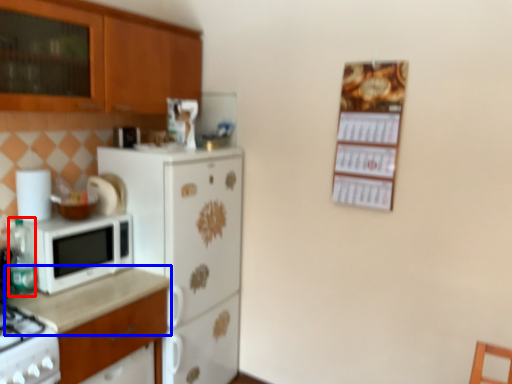
Question: Which object appears closest to the camera in this image, bottle (highlighted by a red box) or countertop (highlighted by a blue box)?

Choices:
 (A) bottle
 (B) countertop

Answer: (B)